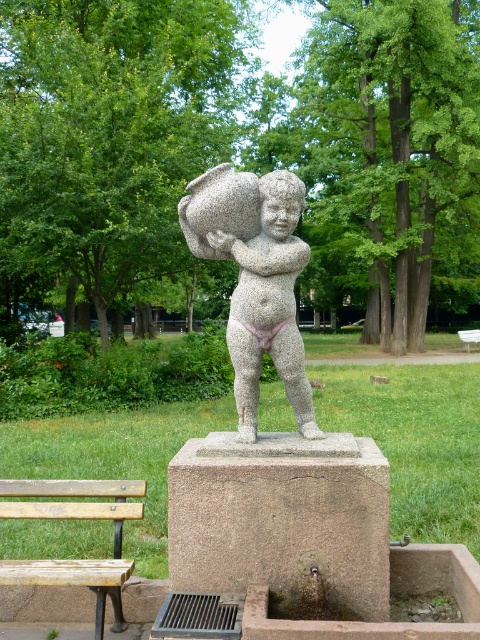
Which is below, wooden bench at lower left or wooden bench at center?

Positioned lower is wooden bench at lower left.

Is point (98, 628) positioned before point (459, 337)?

Yes.

Which is behind, point (113, 481) or point (476, 342)?

The point (476, 342) is behind.

Locate an element on the screen. This screenshot has width=480, height=640. wooden bench at lower left is located at coordinates (75, 516).

Does point (218, 164) come closer to viewer compared to point (128, 481)?

Yes, point (218, 164) is in front of point (128, 481).

Is point (289, 365) closer to camera compared to point (101, 618)?

No, (289, 365) is behind (101, 618).

Image resolution: width=480 pixels, height=640 pixels. Identify the location of granite statue at center. (256, 280).

Can you confirm if granite statue at center is positioned above wooden bench at center?

Yes.

Is granite statue at center below wooden bench at center?

No, granite statue at center is not below wooden bench at center.

Is point (237, 397) farther from viewer compared to point (468, 333)?

That is False.

Locate an element on the screen. Image resolution: width=480 pixels, height=640 pixels. granite statue at center is located at coordinates (256, 280).